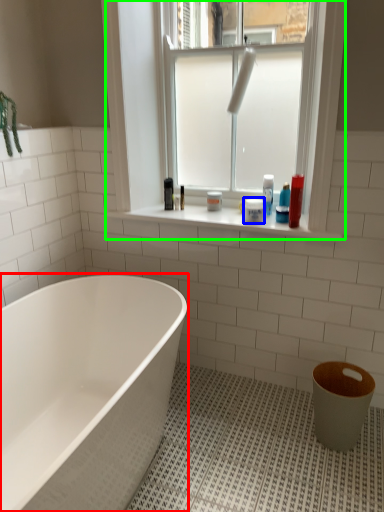
Question: Considering the real-world distances, which object is closest to bathtub (highlighted by a red box)? toiletry (highlighted by a blue box) or window (highlighted by a green box).

Choices:
 (A) toiletry
 (B) window

Answer: (B)